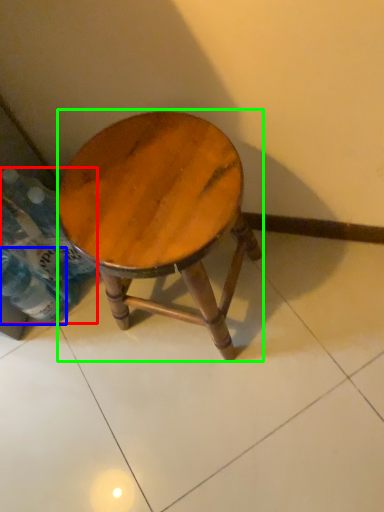
Question: Based on their relative distances, which object is nearer to bottle (highlighted by a red box)? Choose from bottle (highlighted by a blue box) and stool (highlighted by a green box).

Choices:
 (A) bottle
 (B) stool

Answer: (A)